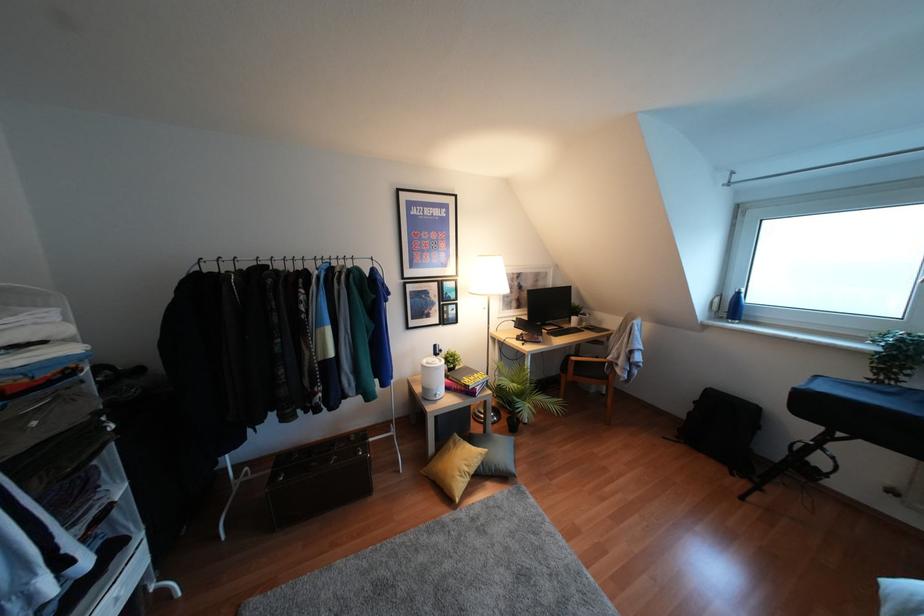
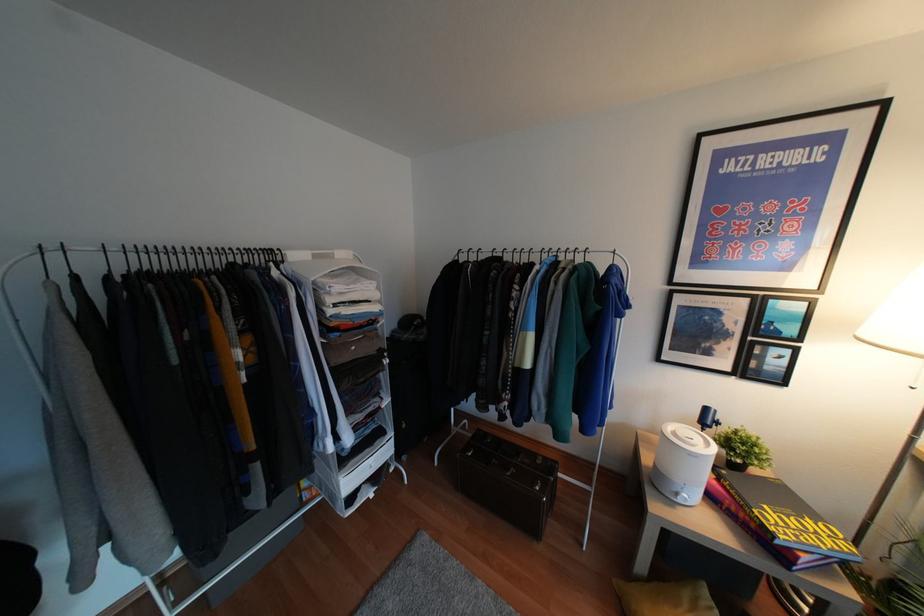
Question: The camera is either moving clockwise (left) or counter-clockwise (right) around the object. The first image is from the beginning of the video and the second image is from the end. Is the camera moving left or right when shooting the video?

Choices:
 (A) Left
 (B) Right

Answer: (B)